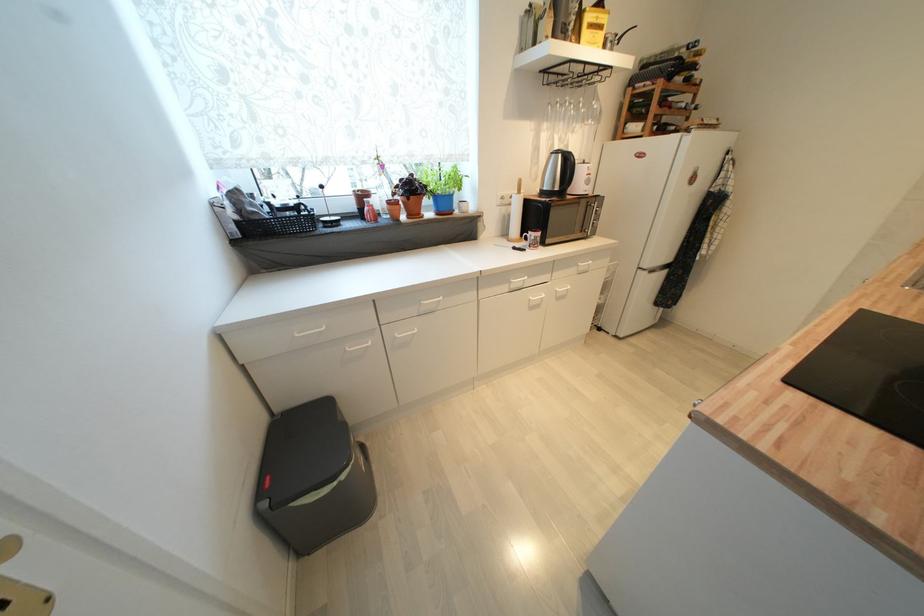
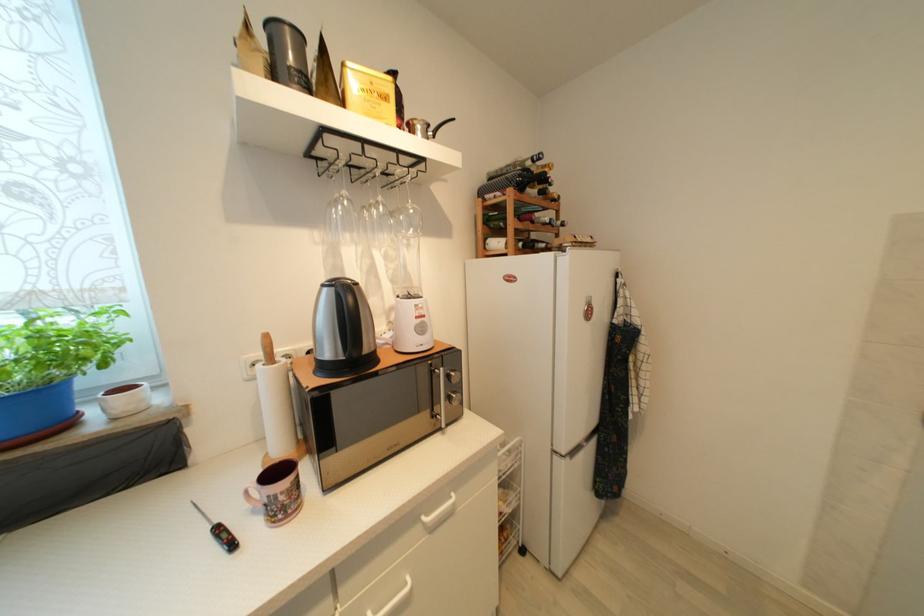
Where in the second image is the point corresponding to [543,236] from the first image?

(289, 485)